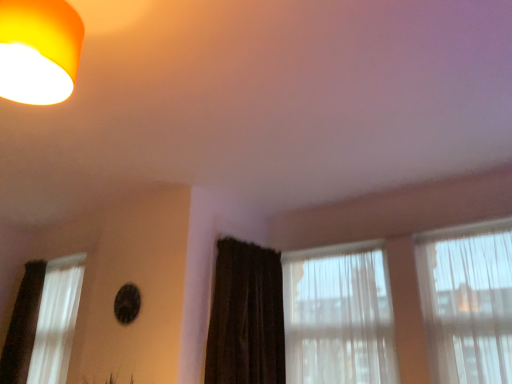
Question: Would you consider translucent fabric curtain at right, placed as the first window when sorted from right to left, to be distant from white sheer curtain at left, the third window in the right-to-left sequence?

Choices:
 (A) yes
 (B) no

Answer: (A)

Question: Does translucent fabric curtain at right, placed as the first window when sorted from right to left, appear on the right side of white sheer curtain at left, the third window in the right-to-left sequence?

Choices:
 (A) yes
 (B) no

Answer: (A)

Question: Does translucent fabric curtain at right, placed as the first window when sorted from right to left, touch white sheer curtain at left, arranged as the first window when viewed from the left?

Choices:
 (A) yes
 (B) no

Answer: (B)

Question: From a real-world perspective, is translucent fabric curtain at right, placed as the first window when sorted from right to left, positioned under white sheer curtain at left, the third window in the right-to-left sequence, based on gravity?

Choices:
 (A) yes
 (B) no

Answer: (B)

Question: Is translucent fabric curtain at right, placed as the first window when sorted from right to left, aimed at white sheer curtain at left, arranged as the first window when viewed from the left?

Choices:
 (A) yes
 (B) no

Answer: (B)

Question: Is matte orange lampshade at upper left inside or outside of translucent fabric curtain at right, placed as the first window when sorted from right to left?

Choices:
 (A) inside
 (B) outside

Answer: (B)

Question: Considering the positions of matte orange lampshade at upper left and translucent fabric curtain at right, placed as the third window when sorted from left to right, in the image, is matte orange lampshade at upper left wider or thinner than translucent fabric curtain at right, placed as the third window when sorted from left to right,?

Choices:
 (A) thin
 (B) wide

Answer: (B)

Question: From a real-world perspective, is matte orange lampshade at upper left positioned above or below translucent fabric curtain at right, placed as the third window when sorted from left to right?

Choices:
 (A) above
 (B) below

Answer: (A)

Question: Does point (60, 69) appear closer or farther from the camera than point (480, 278)?

Choices:
 (A) closer
 (B) farther

Answer: (A)

Question: In the image, is dark brown textured curtain at center positioned in front of or behind translucent fabric curtain at right, placed as the third window when sorted from left to right?

Choices:
 (A) front
 (B) behind

Answer: (B)

Question: In the image, is dark brown textured curtain at center on the left side or the right side of translucent fabric curtain at right, placed as the third window when sorted from left to right?

Choices:
 (A) right
 (B) left

Answer: (B)

Question: Based on their sizes in the image, would you say dark brown textured curtain at center is bigger or smaller than translucent fabric curtain at right, placed as the third window when sorted from left to right?

Choices:
 (A) small
 (B) big

Answer: (B)

Question: From the image's perspective, relative to translucent fabric curtain at right, placed as the first window when sorted from right to left, is dark brown textured curtain at center above or below?

Choices:
 (A) below
 (B) above

Answer: (A)

Question: Relative to matte orange lampshade at upper left, is white sheer curtain at left, arranged as the first window when viewed from the left, in front or behind?

Choices:
 (A) front
 (B) behind

Answer: (B)

Question: Is white sheer curtain at left, the third window in the right-to-left sequence, inside or outside of matte orange lampshade at upper left?

Choices:
 (A) outside
 (B) inside

Answer: (A)